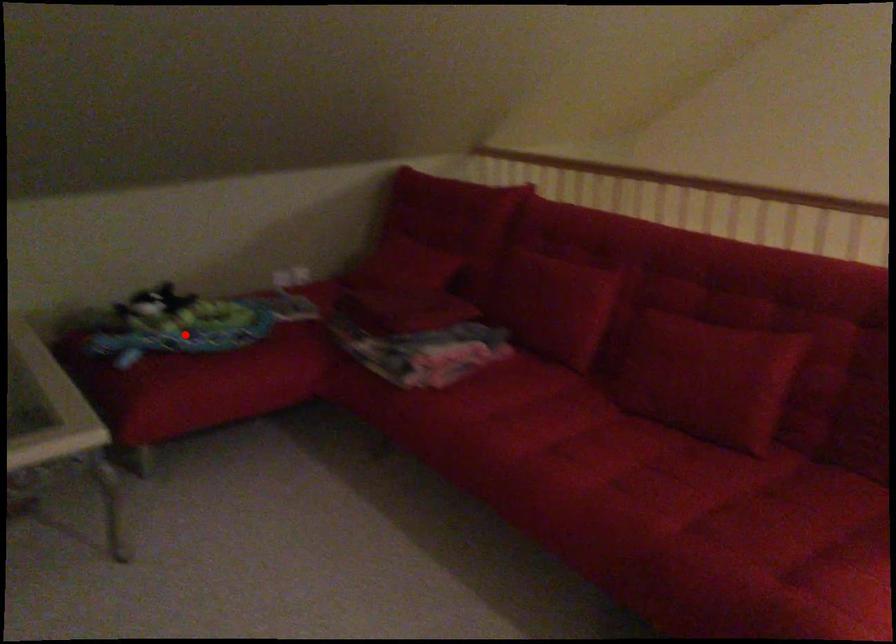
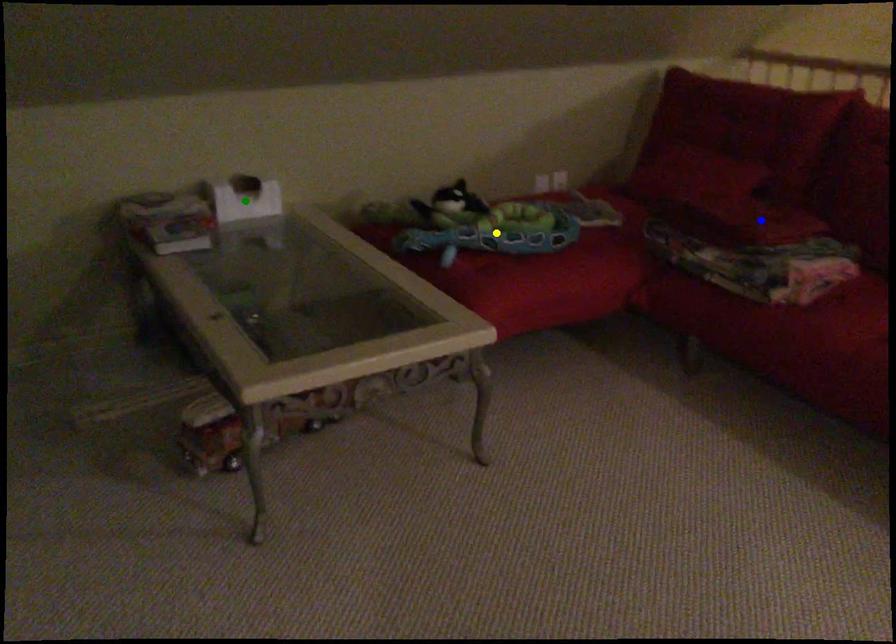
Question: I am providing you with two images of the same scene from different viewpoints. A red point is marked on the first image. You are given multiple points on the second image. Which mark in image 2 goes with the point in image 1?

Choices:
 (A) yellow point
 (B) green point
 (C) blue point

Answer: (A)